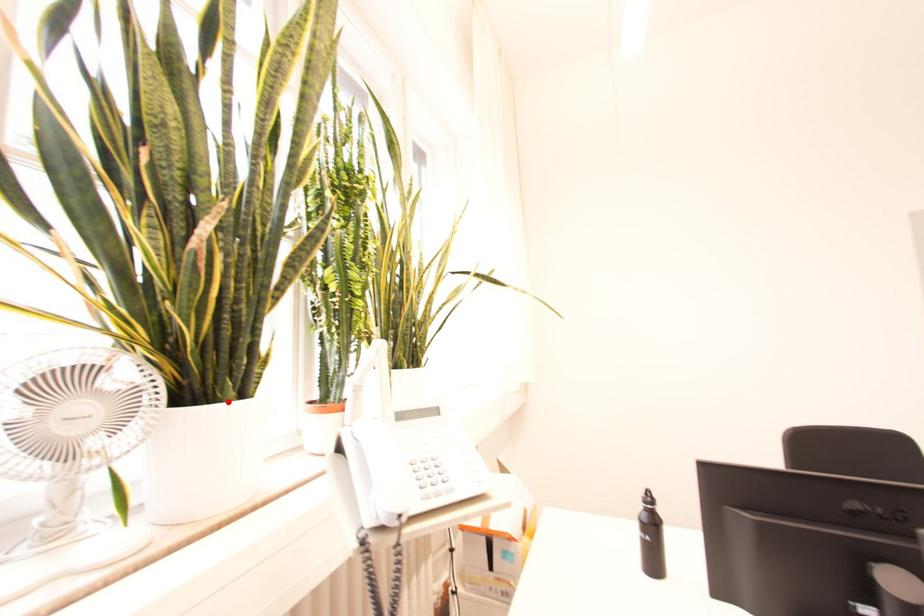
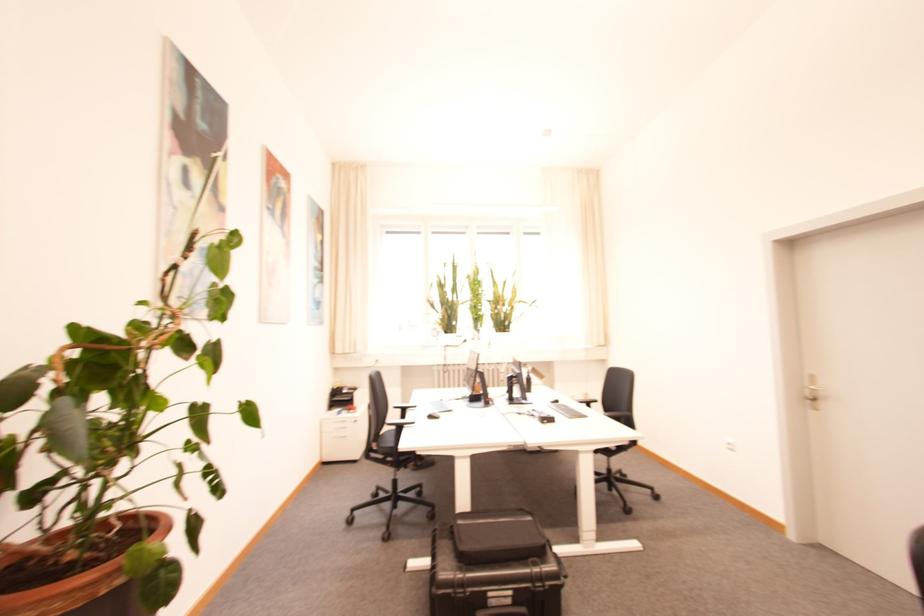
Question: I am providing you with two images of the same scene from different viewpoints. A red point is marked on the first image. At the location where the point appears in image 1, is it still visible in image 2?

Choices:
 (A) Yes
 (B) No

Answer: (B)